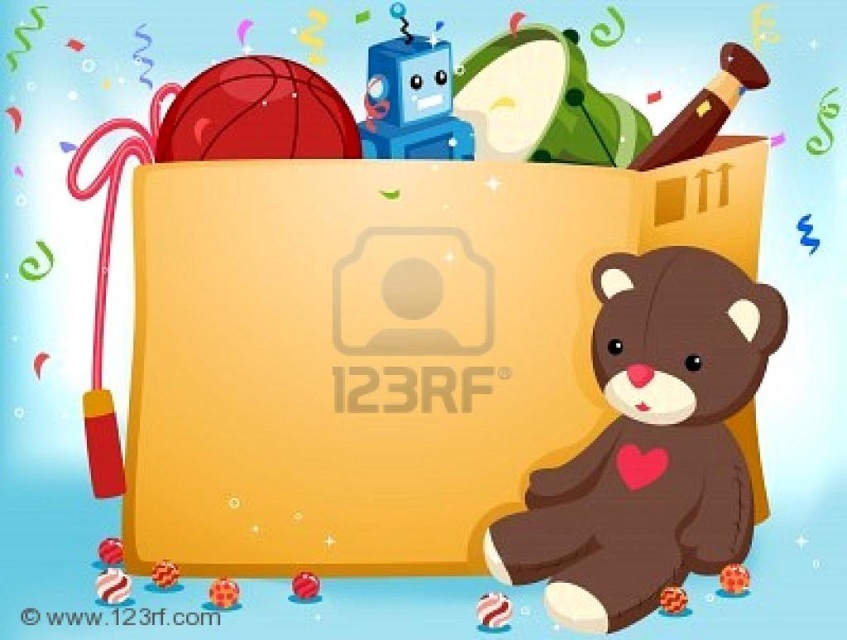
You are arranging decorations for a party and need to know which object is taller between the green fabric pillow at upper center and the striped rubber ball at lower left. Can you tell me which one is taller?

The green fabric pillow at upper center is taller than the striped rubber ball at lower left according to the description.

You are standing in front of the large yellowish orange cardboard box at center. You want to place a new item at the position marked by point (649, 442). What object is currently occupying that location?

The point (649, 442) is occupied by the brown plush bear at lower right.

You are a child who wants to grab both the brown plush bear at lower right and the smooth plastic candy cane at lower left. Which item can you reach first without moving your position?

The brown plush bear at lower right is closer to the viewer than the smooth plastic candy cane at lower left, so you can reach the brown plush bear at lower right first without moving your position.